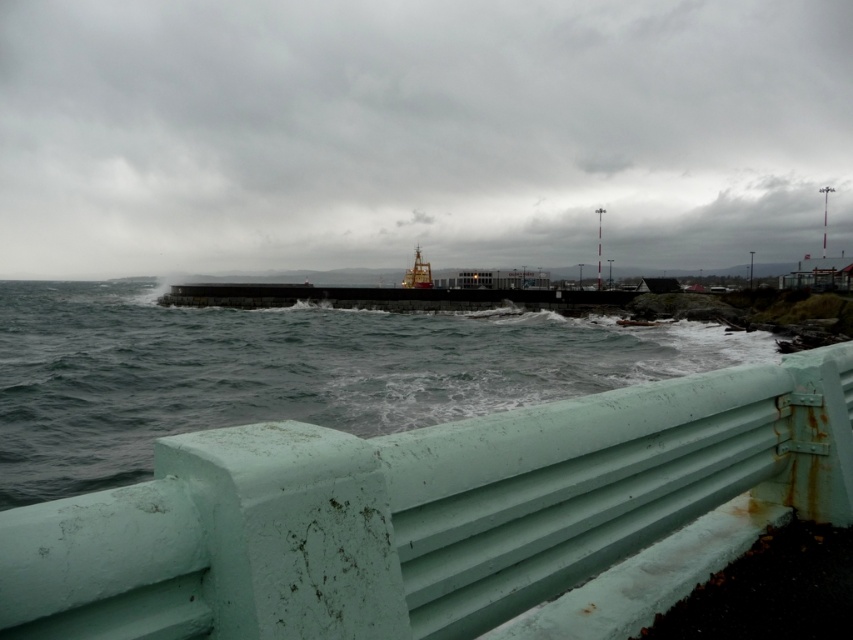
Question: Can you confirm if gray matte water at center is positioned to the right of gold metallic ship at center?

Choices:
 (A) yes
 (B) no

Answer: (B)

Question: Estimate the real-world distances between objects in this image. Which object is farther from the white matte water at lower center?

Choices:
 (A) gray matte water at center
 (B) gold metallic ship at center
 (C) white painted metal barrier at lower center

Answer: (C)

Question: Based on their relative distances, which object is nearer to the gold metallic ship at center?

Choices:
 (A) gray matte water at center
 (B) white matte water at lower center

Answer: (A)

Question: Is white painted metal barrier at lower center above gray matte water at center?

Choices:
 (A) yes
 (B) no

Answer: (B)

Question: Which object is closer to the camera taking this photo?

Choices:
 (A) white painted metal barrier at lower center
 (B) white matte water at lower center

Answer: (A)

Question: Does white painted metal barrier at lower center come in front of gray matte water at center?

Choices:
 (A) yes
 (B) no

Answer: (A)